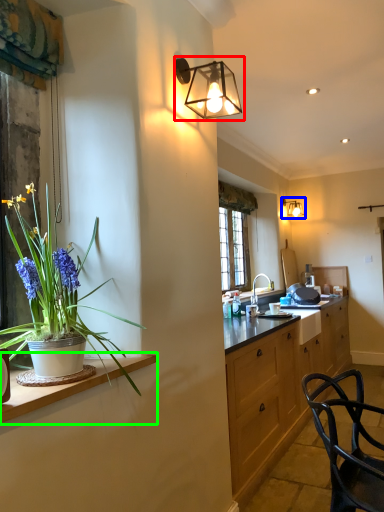
Question: Considering the real-world distances, which object is farthest from lamp (highlighted by a red box)? lamp (highlighted by a blue box) or countertop (highlighted by a green box)?

Choices:
 (A) lamp
 (B) countertop

Answer: (A)